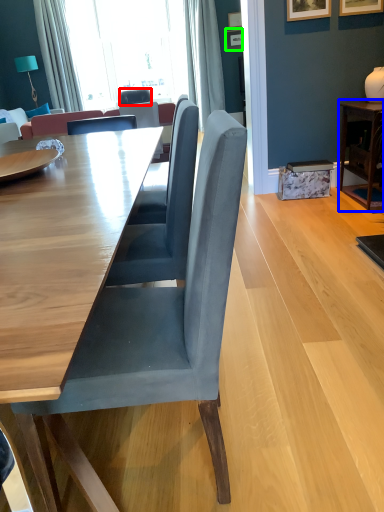
Question: Which object is positioned closest to chair (highlighted by a red box)? Select from table (highlighted by a blue box) and picture frame (highlighted by a green box).

Choices:
 (A) table
 (B) picture frame

Answer: (B)